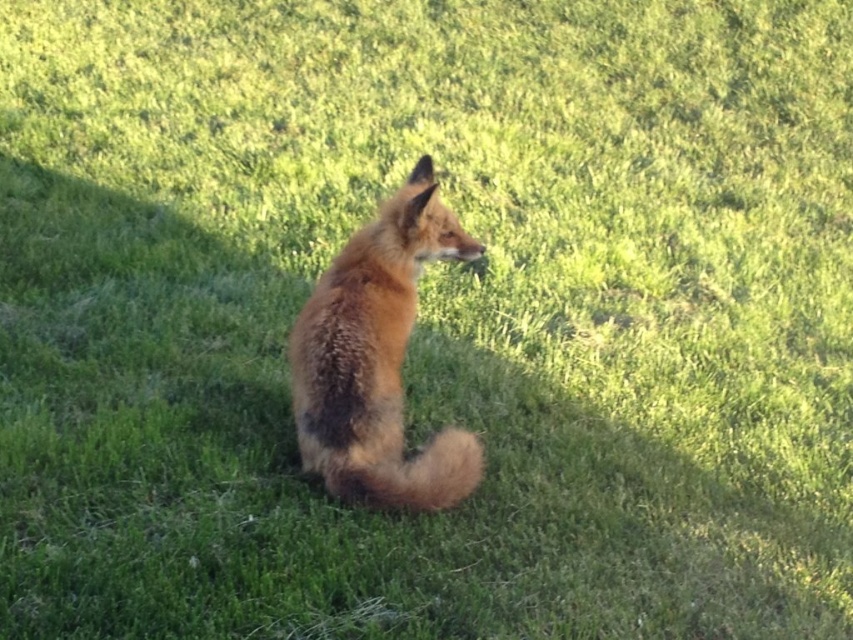
You are standing at the point with coordinates point (389,337) and want to walk towards the point with coordinates point (335,467). Which direction should you face to walk directly towards it?

You should face northeast to walk directly towards point (335,467) from point (389,337).